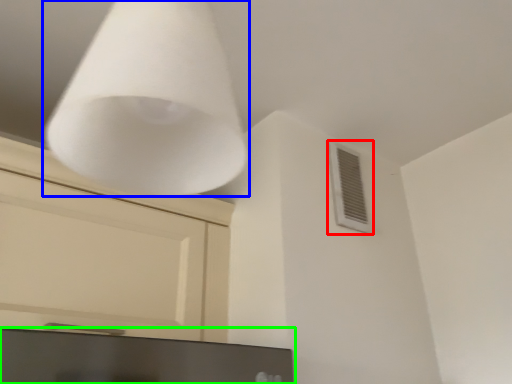
Question: Which is nearer to the air conditioning (highlighted by a red box)? lamp (highlighted by a blue box) or computer monitor (highlighted by a green box).

Choices:
 (A) lamp
 (B) computer monitor

Answer: (B)